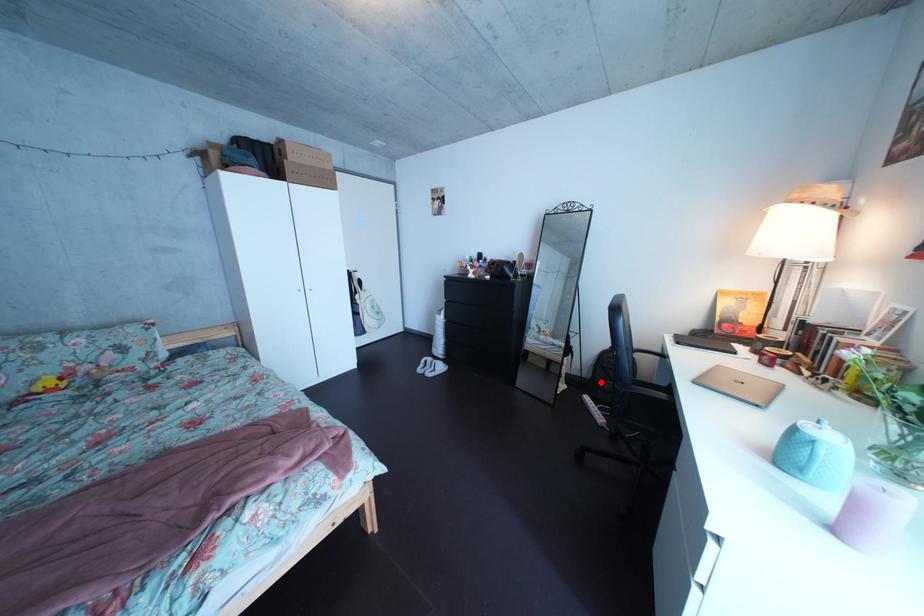
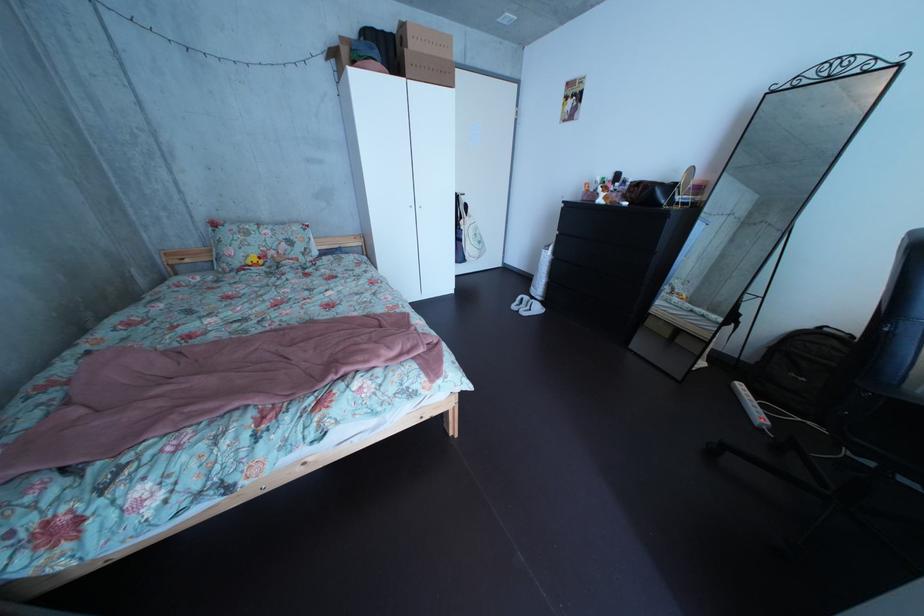
Question: I am providing you with two images of the same scene from different viewpoints. In image1, a red point is highlighted. Considering the same 3D point in image2, which of the following is correct?

Choices:
 (A) It is closer
 (B) It is farther

Answer: (A)